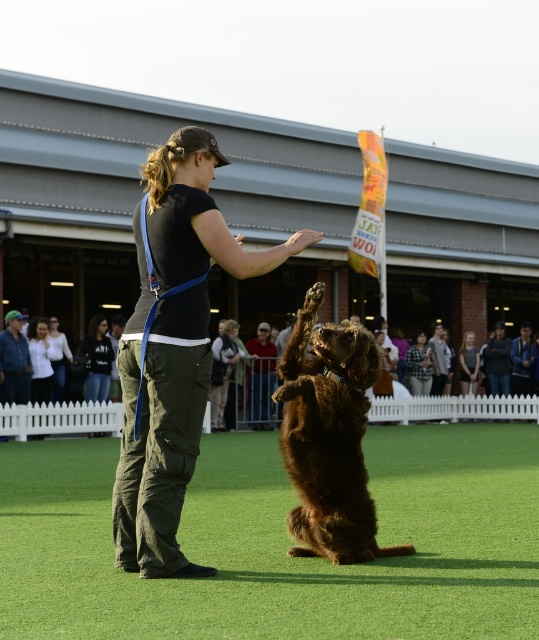
You are a photographer at the dog training event. You need to capture a photo where the brown furry dog at center and the white cotton shirt at center are clearly visible. Based on their sizes, which one will appear larger in the photo?

The brown furry dog at center is taller than the white cotton shirt at center, so the dog will appear larger in the photo.

You are a photographer at the dog training event. You need to capture a photo where the brown furry dog at center and the white cotton shirt at center are clearly visible. Based on their widths, which object should be placed closer to the camera to ensure both fit in the frame?

The brown furry dog at center is wider than the white cotton shirt at center. To ensure both fit in the frame, place the white cotton shirt at center closer to the camera since it is narrower and requires less space.